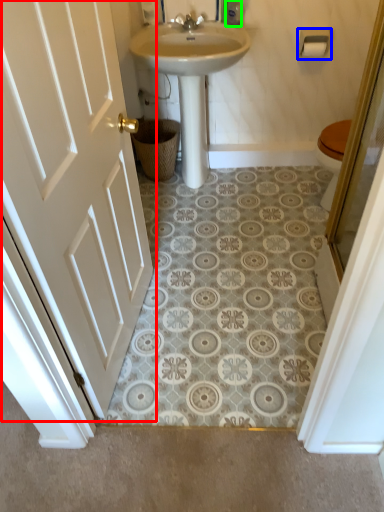
Question: Which is farther away from door (highlighted by a red box)? towel bar (highlighted by a blue box) or toiletry (highlighted by a green box)?

Choices:
 (A) towel bar
 (B) toiletry

Answer: (A)